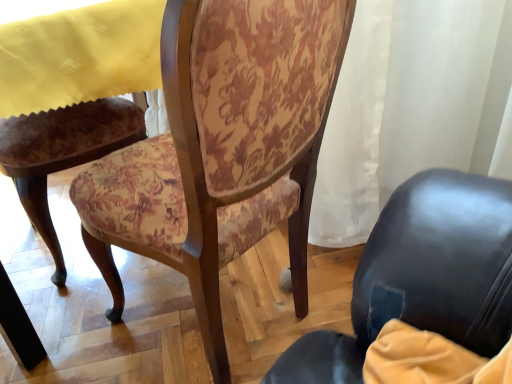
The image size is (512, 384). Describe the element at coordinates (76, 52) in the screenshot. I see `yellow fabric at upper left` at that location.

Find the location of `yellow fabric at upper left`. yellow fabric at upper left is located at coordinates (76, 52).

Locate an element on the screen. The width and height of the screenshot is (512, 384). floral fabric chair at center is located at coordinates (222, 149).

Describe the element at coordinates (222, 149) in the screenshot. I see `floral fabric chair at center` at that location.

Find the location of a particular element. This screenshot has height=384, width=512. yellow fabric at upper left is located at coordinates (76, 52).

Considering the relative positions of yellow fabric at upper left and floral fabric chair at center in the image provided, is yellow fabric at upper left to the right of floral fabric chair at center from the viewer's perspective?

Incorrect, yellow fabric at upper left is not on the right side of floral fabric chair at center.

Does yellow fabric at upper left lie behind floral fabric chair at center?

Yes, it is.

Which is in front, point (101, 17) or point (104, 212)?

The point (104, 212) is closer to the camera.

From the image's perspective, is yellow fabric at upper left located above or below floral fabric chair at center?

From the image's perspective, yellow fabric at upper left appears above floral fabric chair at center.

Based on the photo, from a real-world perspective, which object stands above the other?

From a 3D spatial view, yellow fabric at upper left is above.

Is yellow fabric at upper left thinner than floral fabric chair at center?

Yes.

Considering the sizes of objects yellow fabric at upper left and floral fabric chair at center in the image provided, who is taller, yellow fabric at upper left or floral fabric chair at center?

With more height is floral fabric chair at center.

Considering the relative sizes of yellow fabric at upper left and floral fabric chair at center in the image provided, is yellow fabric at upper left bigger than floral fabric chair at center?

Actually, yellow fabric at upper left might be smaller than floral fabric chair at center.

Which is correct: yellow fabric at upper left is inside floral fabric chair at center, or outside of it?

yellow fabric at upper left cannot be found inside floral fabric chair at center.

Is yellow fabric at upper left in contact with floral fabric chair at center?

No, yellow fabric at upper left is not with floral fabric chair at center.

Looking at this image, does yellow fabric at upper left turn towards floral fabric chair at center?

No, yellow fabric at upper left is not oriented towards floral fabric chair at center.

How different are the orientations of yellow fabric at upper left and floral fabric chair at center in degrees?

yellow fabric at upper left and floral fabric chair at center are facing 83.8 degrees away from each other.

At what (x,y) coordinates should I click in order to perform the action: click on tablecloth above the floral fabric chair at center (from a real-world perspective). Please return your answer as a coordinate pair (x, y). The height and width of the screenshot is (384, 512). Looking at the image, I should click on (76, 52).

Visually, is floral fabric chair at center positioned to the left or to the right of yellow fabric at upper left?

Based on their positions, floral fabric chair at center is located to the right of yellow fabric at upper left.

Which is in front, floral fabric chair at center or yellow fabric at upper left?

Positioned in front is floral fabric chair at center.

Is point (302, 247) farther from viewer compared to point (122, 36)?

Yes, point (302, 247) is farther from viewer.

From the image's perspective, who appears lower, floral fabric chair at center or yellow fabric at upper left?

From the image's view, floral fabric chair at center is below.

From a real-world perspective, does floral fabric chair at center sit lower than yellow fabric at upper left?

Indeed, from a real-world perspective, floral fabric chair at center is positioned beneath yellow fabric at upper left.

Does floral fabric chair at center have a lesser width compared to yellow fabric at upper left?

In fact, floral fabric chair at center might be wider than yellow fabric at upper left.

Considering the relative sizes of floral fabric chair at center and yellow fabric at upper left in the image provided, is floral fabric chair at center taller than yellow fabric at upper left?

Correct, floral fabric chair at center is much taller as yellow fabric at upper left.

In terms of size, does floral fabric chair at center appear bigger or smaller than yellow fabric at upper left?

Clearly, floral fabric chair at center is larger in size than yellow fabric at upper left.

Is yellow fabric at upper left completely or partially inside floral fabric chair at center?

No, floral fabric chair at center does not contain yellow fabric at upper left.

Does floral fabric chair at center touch yellow fabric at upper left?

No, floral fabric chair at center is not making contact with yellow fabric at upper left.

Does floral fabric chair at center turn towards yellow fabric at upper left?

Yes, floral fabric chair at center is turned towards yellow fabric at upper left.

Measure the distance between floral fabric chair at center and yellow fabric at upper left.

A distance of 33.31 centimeters exists between floral fabric chair at center and yellow fabric at upper left.

Identify the location of chair located in front of the yellow fabric at upper left. (222, 149).

Identify the location of chair lying on the right of yellow fabric at upper left. pyautogui.click(x=222, y=149).

Locate an element on the screen. The height and width of the screenshot is (384, 512). tablecloth to the left of floral fabric chair at center is located at coordinates (76, 52).